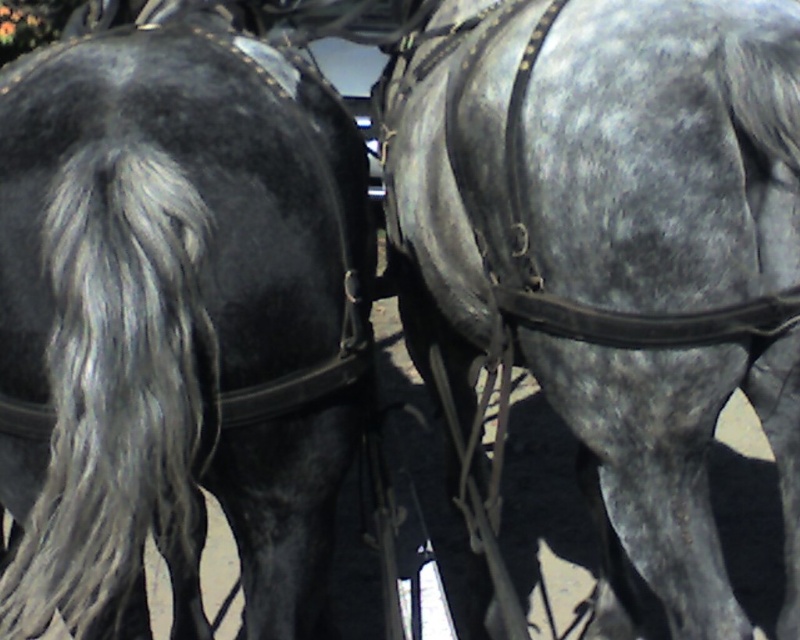
What do you see at coordinates (176, 324) in the screenshot? The height and width of the screenshot is (640, 800). I see `shiny black horse at left` at bounding box center [176, 324].

Based on the photo, which is above, shiny black horse at left or gray textured horse at center?

gray textured horse at center

Locate an element on the screen. The image size is (800, 640). shiny black horse at left is located at coordinates (176, 324).